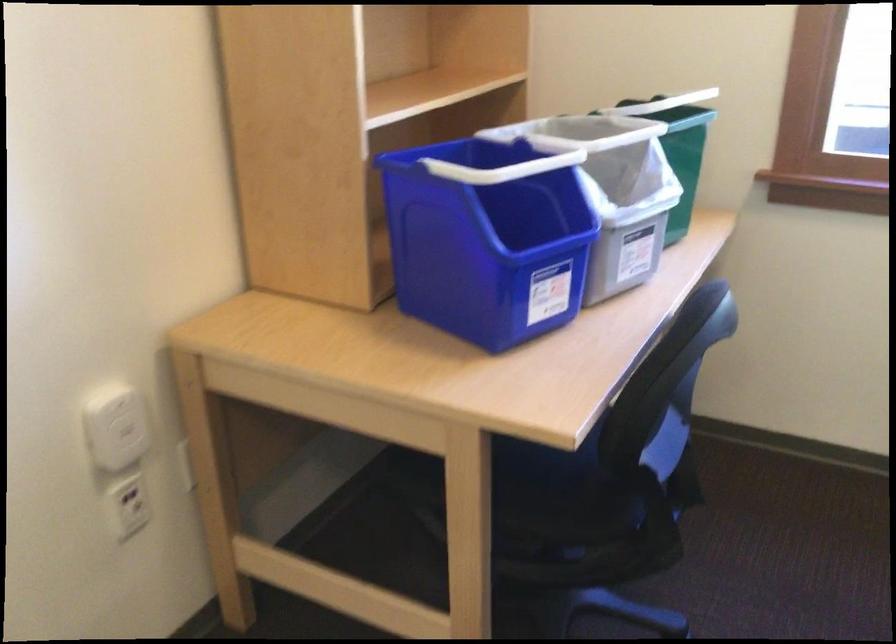
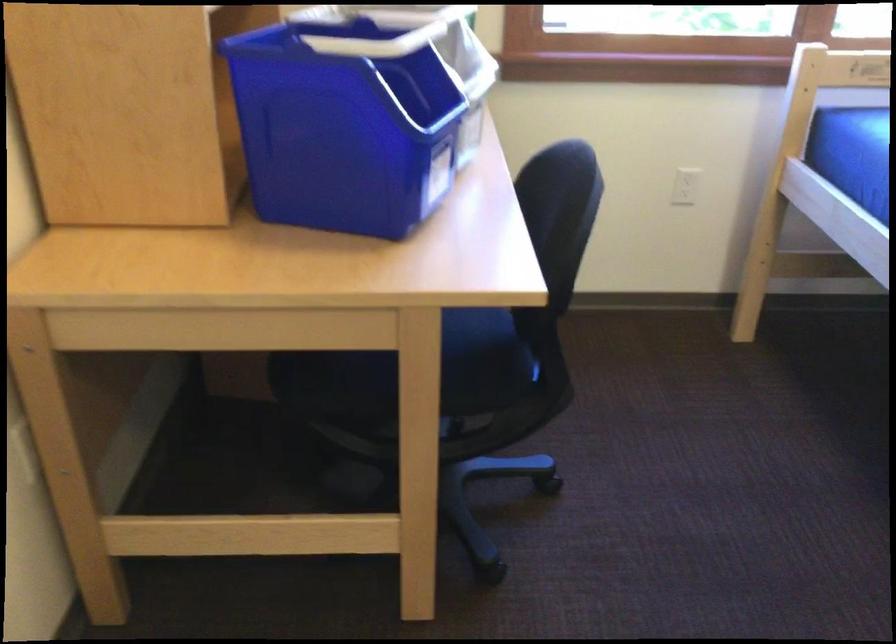
The point at (769, 147) is marked in the first image. Where is the corresponding point in the second image?

(506, 26)